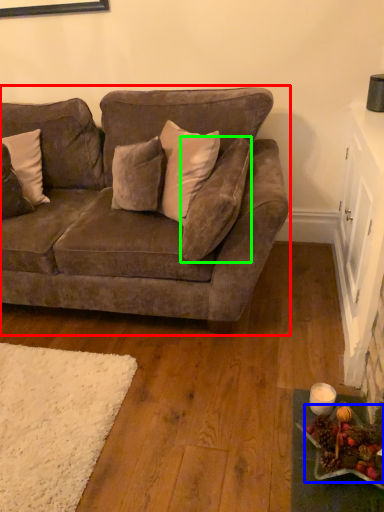
Question: Which object is positioned closest to studio couch (highlighted by a red box)? Select from food (highlighted by a blue box) and pillow (highlighted by a green box).

Choices:
 (A) food
 (B) pillow

Answer: (B)